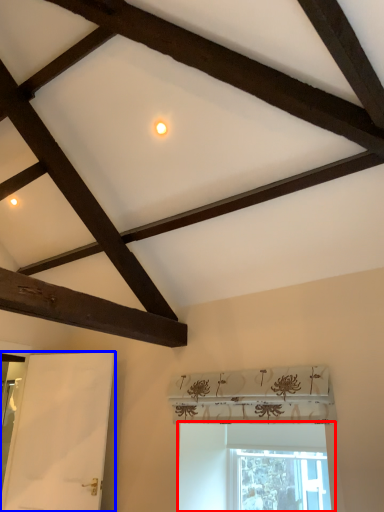
Question: Which object is further to the camera taking this photo, window (highlighted by a red box) or screen door (highlighted by a blue box)?

Choices:
 (A) window
 (B) screen door

Answer: (B)